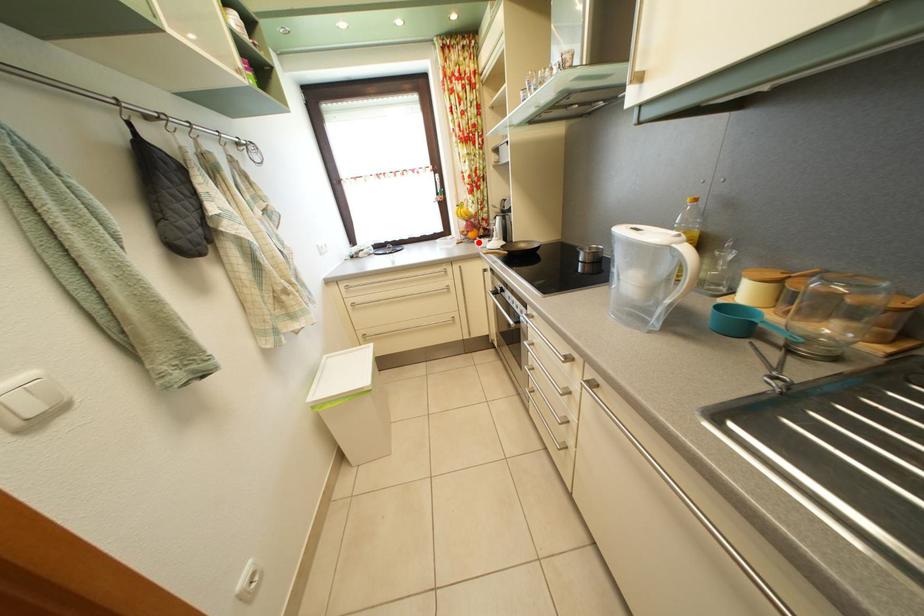
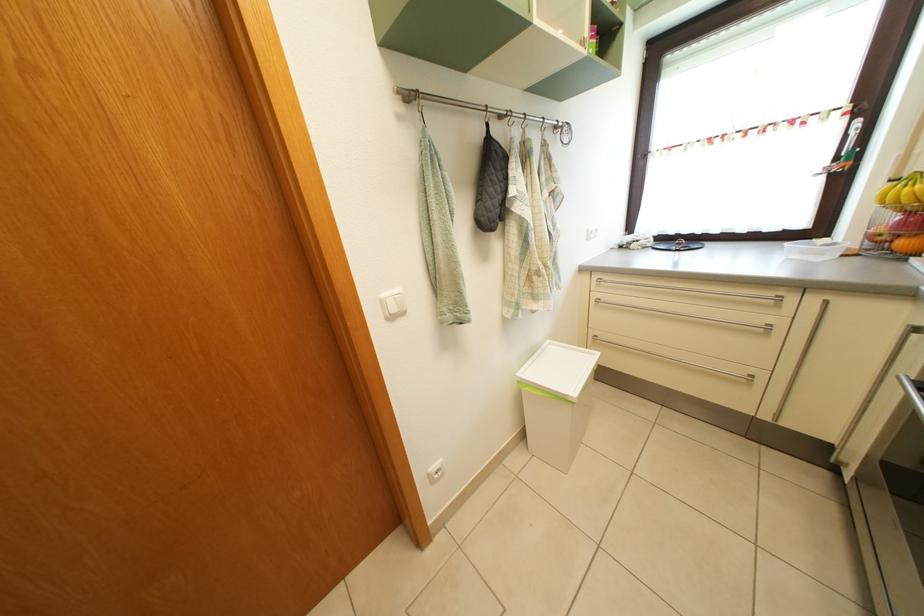
Question: A red point is marked in image1. In image2, is the corresponding 3D point closer to the camera or farther? Reply with the corresponding letter.

Choices:
 (A) The corresponding 3D point is closer.
 (B) The corresponding 3D point is farther.

Answer: (B)